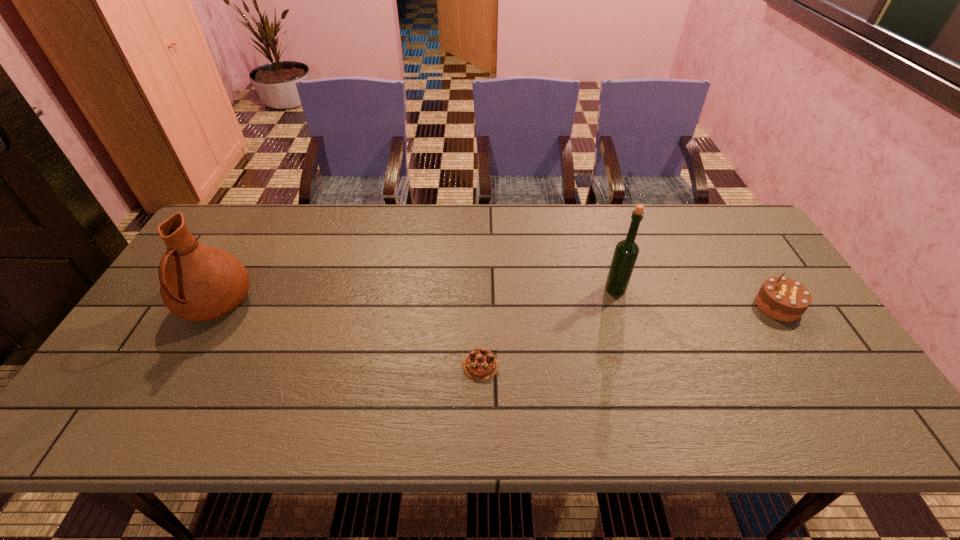
The height and width of the screenshot is (540, 960). Identify the location of object that is at the left edge. (199, 283).

Identify the location of object located in the right edge section of the desktop. The width and height of the screenshot is (960, 540). (783, 299).

The height and width of the screenshot is (540, 960). In the image, there is a desktop. Identify the location of vacant space at the far edge. (348, 247).

You are a GUI agent. You are given a task and a screenshot of the screen. Output one action in this format:
    pyautogui.click(x=<x>, y=<y>)
    Task: Click on the free space at the near edge of the desktop
    The image size is (960, 540).
    Given the screenshot: What is the action you would take?
    [608, 433]

Image resolution: width=960 pixels, height=540 pixels. In the image, there is a desktop. Identify the location of free space at the left edge. (239, 259).

Identify the location of free space at the right edge of the desktop. This screenshot has height=540, width=960. (727, 273).

This screenshot has width=960, height=540. What are the coordinates of `vacant space at the far right corner of the desktop` in the screenshot? It's located at (718, 240).

Where is `vacant space that is in between the leftmost object and the taller chocolate cake`? The height and width of the screenshot is (540, 960). vacant space that is in between the leftmost object and the taller chocolate cake is located at coordinates [x=497, y=306].

Find the location of a particular element. The image size is (960, 540). free spot between the left chocolate cake and the taller chocolate cake is located at coordinates (629, 336).

Where is `free spot between the third object from right to left and the pitcher`? free spot between the third object from right to left and the pitcher is located at coordinates (348, 335).